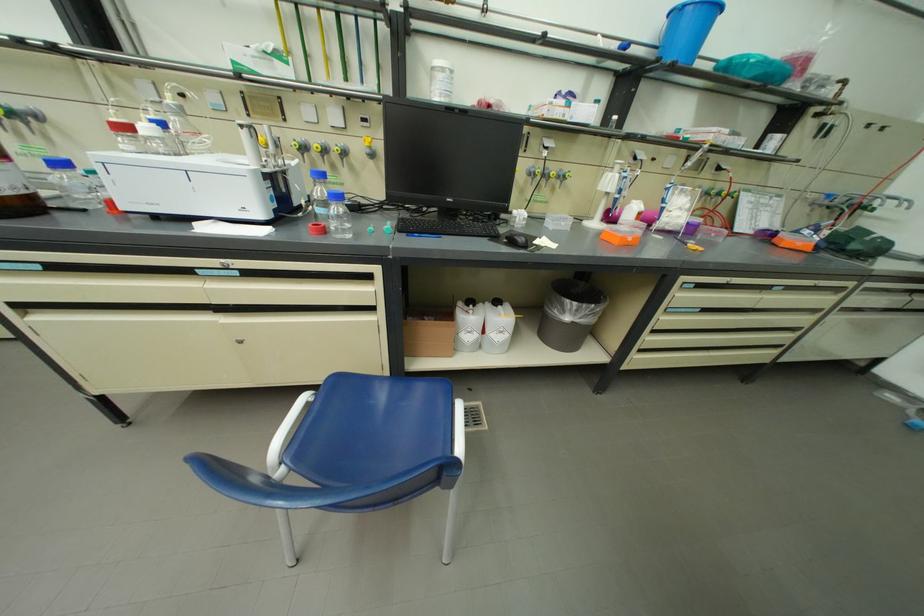
Locate an element on the screen. yellow valve knob is located at coordinates (318, 147).